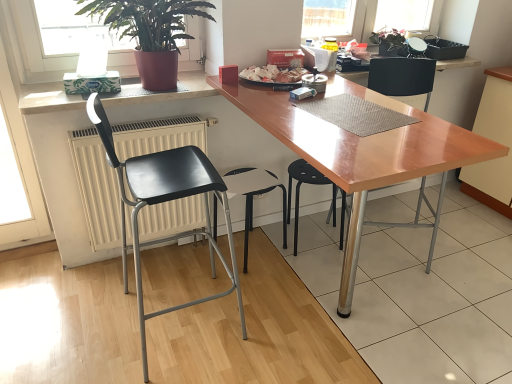
Locate an element on the screen. The height and width of the screenshot is (384, 512). free space to the back side of matte black chair at center, arranged as the fourth chair when viewed from the left is located at coordinates (390, 213).